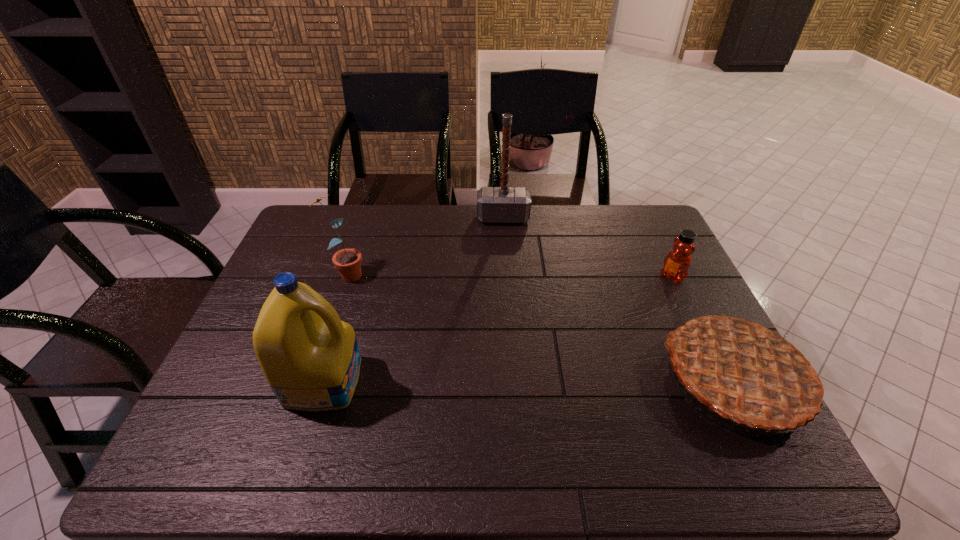
At what (x,y) coordinates should I click in order to perform the action: click on vacant area that lies between the pie and the third object from left to right. Please return your answer as a coordinate pair (x, y). The width and height of the screenshot is (960, 540). Looking at the image, I should click on (619, 298).

I want to click on free space between the detergent and the honey, so click(498, 328).

You are a GUI agent. You are given a task and a screenshot of the screen. Output one action in this format:
    pyautogui.click(x=<x>, y=<y>)
    Task: Click on the free space between the pie and the sunflower
    The height and width of the screenshot is (540, 960).
    Given the screenshot: What is the action you would take?
    pyautogui.click(x=540, y=326)

You are a GUI agent. You are given a task and a screenshot of the screen. Output one action in this format:
    pyautogui.click(x=<x>, y=<y>)
    Task: Click on the free area in between the honey and the hammer
    This screenshot has height=540, width=960.
    Given the screenshot: What is the action you would take?
    pyautogui.click(x=588, y=247)

Locate an element on the screen. vacant area that lies between the detergent and the farthest object is located at coordinates (414, 299).

Where is `empty space between the shortest object and the third object from right to left`? The image size is (960, 540). empty space between the shortest object and the third object from right to left is located at coordinates (588, 247).

Where is `free point between the hammer and the honey`? free point between the hammer and the honey is located at coordinates click(588, 247).

Find the location of a particular element. The image size is (960, 540). the third closest object to the honey is located at coordinates (310, 358).

What are the coordinates of `object that is the second closest one to the honey` in the screenshot? It's located at (504, 204).

This screenshot has width=960, height=540. Find the location of `vacant space that satisfies the following two spatial constraints: 1. on the front side of the detergent; 2. on the label of the sunflower`. vacant space that satisfies the following two spatial constraints: 1. on the front side of the detergent; 2. on the label of the sunflower is located at coordinates (308, 380).